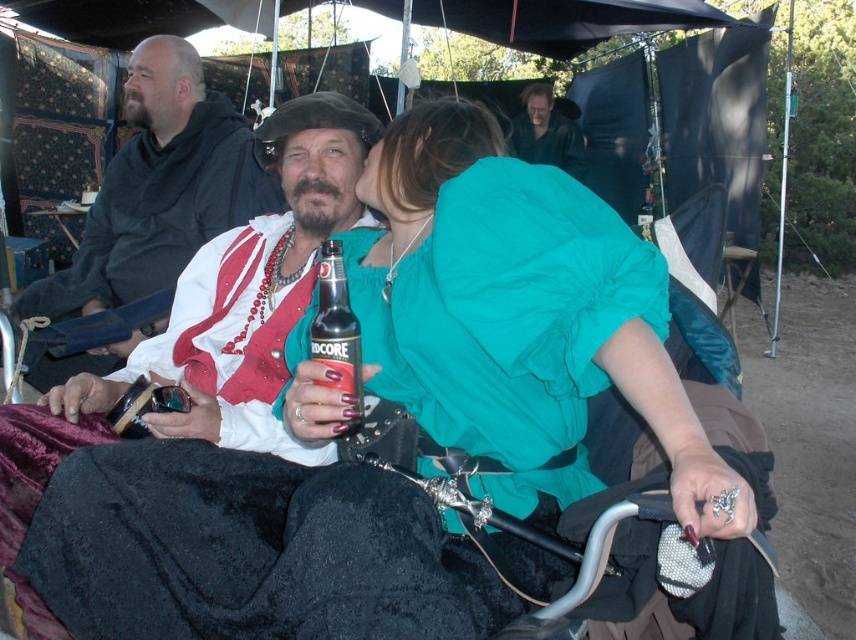
Which is behind, point (277, 116) or point (171, 108)?

Positioned behind is point (171, 108).

Can you confirm if shiny leather jacket at center is smaller than white fabric shirt at center?

Indeed, shiny leather jacket at center has a smaller size compared to white fabric shirt at center.

Which is in front, point (331, 204) or point (111, 193)?

Point (331, 204) is more forward.

In order to click on shiny leather jacket at center in this screenshot , I will do tap(207, 330).

Which is above, white fabric shirt at center or smooth black shirt at upper center?

smooth black shirt at upper center is above.

Who is more forward, (183, 241) or (580, 160)?

Point (183, 241) is more forward.

Is point (131, 227) positioned in front of point (551, 164)?

Yes, it is.

In order to click on white fabric shirt at center in this screenshot , I will do `click(158, 188)`.

Measure the distance from white fabric shirt at center to black glass bottle at center.

The distance of white fabric shirt at center from black glass bottle at center is 1.33 meters.

Which of these two, white fabric shirt at center or black glass bottle at center, stands shorter?

Standing shorter between the two is black glass bottle at center.

Which is behind, point (230, 170) or point (342, 289)?

The point (230, 170) is behind.

Identify the location of white fabric shirt at center. Image resolution: width=856 pixels, height=640 pixels. (158, 188).